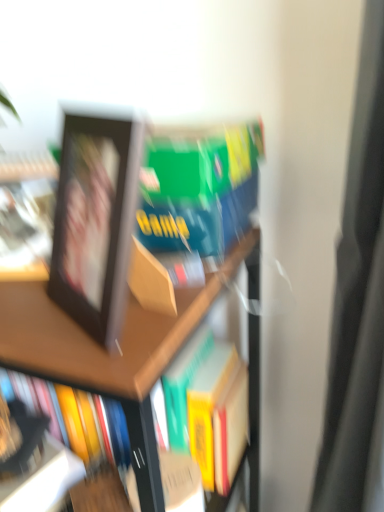
Question: Should I look upward or downward to see matte black photo frame at left?

Choices:
 (A) down
 (B) up

Answer: (B)

Question: Does wooden bookshelf at upper left come in front of matte black photo frame at left?

Choices:
 (A) no
 (B) yes

Answer: (B)

Question: Considering the relative positions of wooden bookshelf at upper left and matte black photo frame at left in the image provided, is wooden bookshelf at upper left to the right of matte black photo frame at left from the viewer's perspective?

Choices:
 (A) yes
 (B) no

Answer: (A)

Question: Considering the relative sizes of wooden bookshelf at upper left and matte black photo frame at left in the image provided, is wooden bookshelf at upper left shorter than matte black photo frame at left?

Choices:
 (A) yes
 (B) no

Answer: (B)

Question: From a real-world perspective, is wooden bookshelf at upper left physically below matte black photo frame at left?

Choices:
 (A) yes
 (B) no

Answer: (A)

Question: From a real-world perspective, is wooden bookshelf at upper left physically above matte black photo frame at left?

Choices:
 (A) no
 (B) yes

Answer: (A)

Question: Is wooden bookshelf at upper left oriented away from matte black photo frame at left?

Choices:
 (A) yes
 (B) no

Answer: (B)

Question: Is wooden bookshelf at upper left next to black matte picture frame at upper left and touching it?

Choices:
 (A) yes
 (B) no

Answer: (B)

Question: From the image's perspective, is wooden bookshelf at upper left below black matte picture frame at upper left?

Choices:
 (A) no
 (B) yes

Answer: (B)

Question: Considering the relative positions of wooden bookshelf at upper left and black matte picture frame at upper left in the image provided, is wooden bookshelf at upper left to the left of black matte picture frame at upper left from the viewer's perspective?

Choices:
 (A) no
 (B) yes

Answer: (B)

Question: From a real-world perspective, is wooden bookshelf at upper left located beneath black matte picture frame at upper left?

Choices:
 (A) no
 (B) yes

Answer: (B)

Question: Can you confirm if wooden bookshelf at upper left is smaller than black matte picture frame at upper left?

Choices:
 (A) no
 (B) yes

Answer: (A)

Question: Is wooden bookshelf at upper left positioned with its back to black matte picture frame at upper left?

Choices:
 (A) no
 (B) yes

Answer: (A)

Question: Is matte black photo frame at left facing towards black matte picture frame at upper left?

Choices:
 (A) no
 (B) yes

Answer: (A)